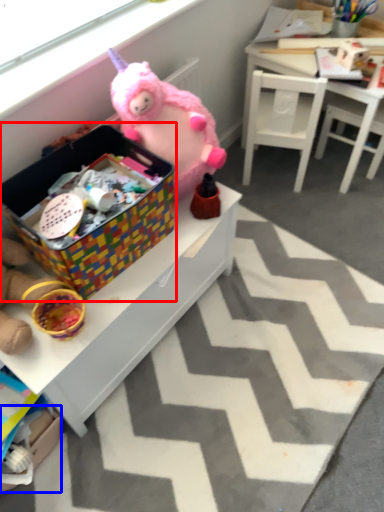
Question: Among these objects, which one is nearest to the camera, storage box (highlighted by a red box) or cardboard box (highlighted by a blue box)?

Choices:
 (A) storage box
 (B) cardboard box

Answer: (A)